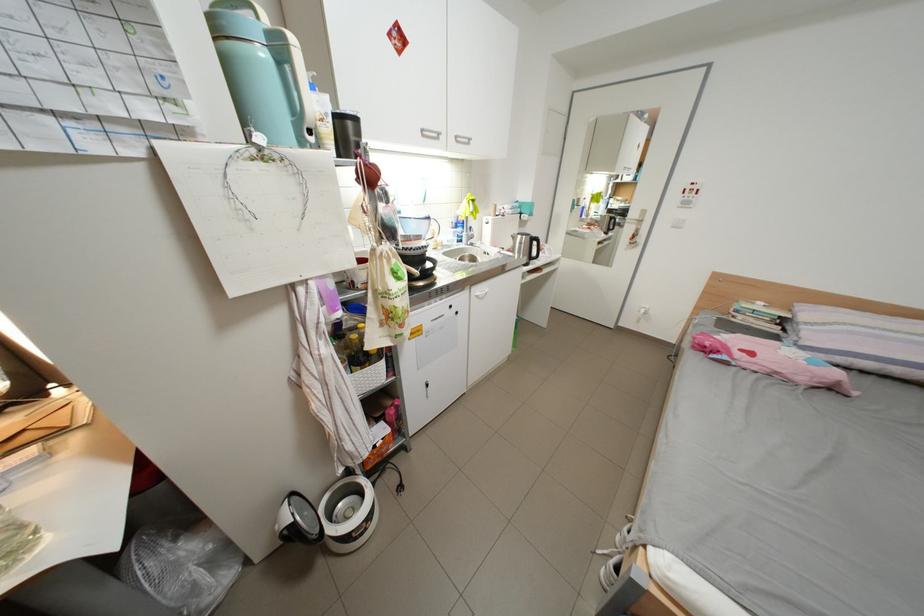
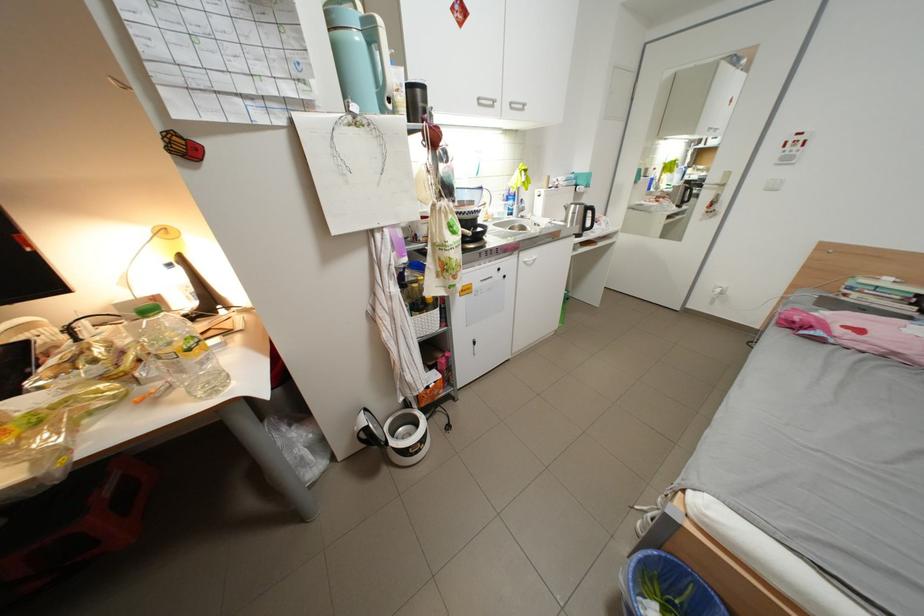
The point at (272, 140) is marked in the first image. Where is the corresponding point in the second image?

(367, 108)